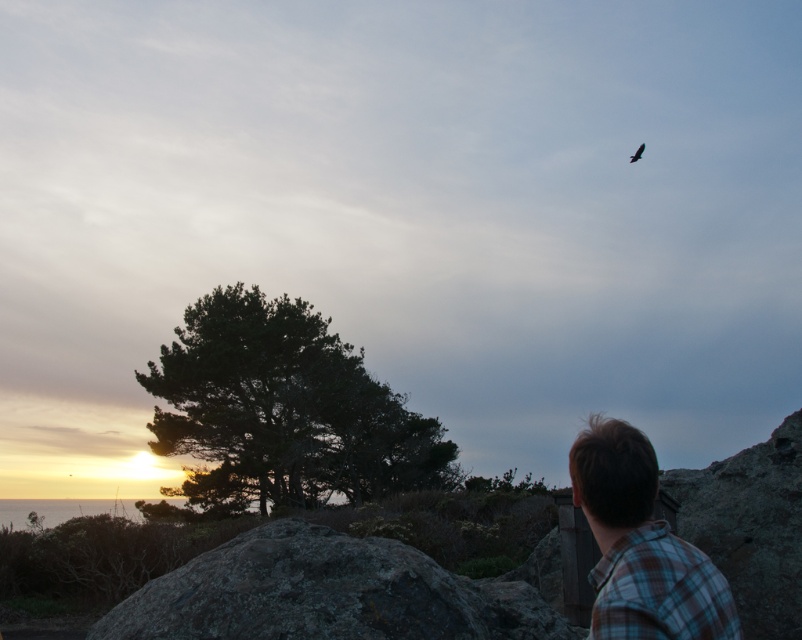
Between dark green textured tree at center-left and plaid fabric shirt at lower right, which one has less height?

With less height is plaid fabric shirt at lower right.

Which is above, dark green textured tree at center-left or plaid fabric shirt at lower right?

Positioned higher is plaid fabric shirt at lower right.

Who is more distant from viewer, (314, 481) or (699, 550)?

The point (314, 481) is behind.

Image resolution: width=802 pixels, height=640 pixels. Find the location of `dark green textured tree at center-left`. dark green textured tree at center-left is located at coordinates (282, 410).

Which of these two, plaid fabric shirt at lower right or dark brown feathered bird at upper right, stands shorter?

Standing shorter between the two is plaid fabric shirt at lower right.

Measure the distance between plaid fabric shirt at lower right and dark brown feathered bird at upper right.

plaid fabric shirt at lower right and dark brown feathered bird at upper right are 117.36 feet apart from each other.

Is point (608, 529) positioned after point (634, 156)?

No, (608, 529) is in front of (634, 156).

Image resolution: width=802 pixels, height=640 pixels. I want to click on plaid fabric shirt at lower right, so [x=641, y=547].

Does dark green textured tree at center-left appear on the left side of dark brown feathered bird at upper right?

Yes, dark green textured tree at center-left is to the left of dark brown feathered bird at upper right.

Who is positioned more to the left, dark green textured tree at center-left or dark brown feathered bird at upper right?

dark green textured tree at center-left

Who is more forward, (261,500) or (638,154)?

Point (638,154) is more forward.

Where is `dark green textured tree at center-left`? The width and height of the screenshot is (802, 640). dark green textured tree at center-left is located at coordinates (282, 410).